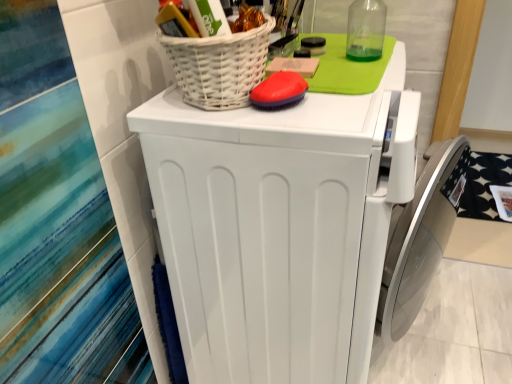
Question: Considering the positions of red rubber brush at upper center and white wicker basket at upper center in the image, is red rubber brush at upper center bigger or smaller than white wicker basket at upper center?

Choices:
 (A) big
 (B) small

Answer: (B)

Question: From a real-world perspective, is red rubber brush at upper center positioned above or below white wicker basket at upper center?

Choices:
 (A) below
 (B) above

Answer: (A)

Question: Based on their relative distances, which object is farther from the white matte washing machine at center?

Choices:
 (A) red rubber brush at upper center
 (B) white wicker basket at upper center

Answer: (A)

Question: Estimate the real-world distances between objects in this image. Which object is closer to the white matte washing machine at center?

Choices:
 (A) red rubber brush at upper center
 (B) white wicker basket at upper center

Answer: (B)